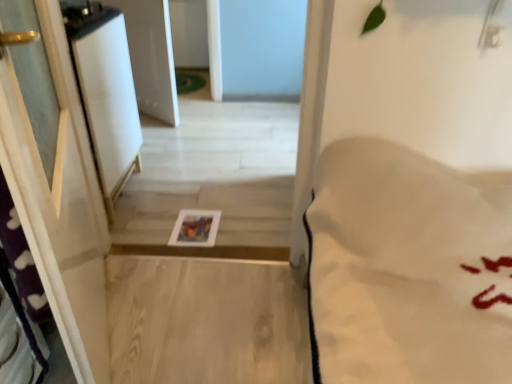
Where is `white soft bedsheet at right`? The image size is (512, 384). white soft bedsheet at right is located at coordinates (408, 268).

What do you see at coordinates (408, 268) in the screenshot? I see `white soft bedsheet at right` at bounding box center [408, 268].

Find the location of a particular element. white glossy screen door at left is located at coordinates (106, 93).

The width and height of the screenshot is (512, 384). Describe the element at coordinates (106, 93) in the screenshot. I see `white glossy screen door at left` at that location.

The image size is (512, 384). Identify the location of white soft bedsheet at right. (408, 268).

Consider the image. Would you say white soft bedsheet at right is to the left or to the right of white glossy screen door at left in the picture?

Clearly, white soft bedsheet at right is on the right of white glossy screen door at left in the image.

Is the depth of white soft bedsheet at right greater than that of white glossy screen door at left?

No, it is in front of white glossy screen door at left.

Is point (410, 271) positioned after point (95, 30)?

No.

From the image's perspective, is white soft bedsheet at right located above or below white glossy screen door at left?

Clearly, from the image's perspective, white soft bedsheet at right is below white glossy screen door at left.

From a real-world perspective, is white soft bedsheet at right positioned over white glossy screen door at left based on gravity?

No, from a real-world perspective, white soft bedsheet at right is not over white glossy screen door at left

Does white soft bedsheet at right have a lesser width compared to white glossy screen door at left?

No, white soft bedsheet at right is not thinner than white glossy screen door at left.

In the scene shown: From their relative heights in the image, would you say white soft bedsheet at right is taller or shorter than white glossy screen door at left?

Clearly, white soft bedsheet at right is taller compared to white glossy screen door at left.

Which of these two, white soft bedsheet at right or white glossy screen door at left, is smaller?

Smaller between the two is white glossy screen door at left.

Is white soft bedsheet at right inside the boundaries of white glossy screen door at left, or outside?

white soft bedsheet at right is spatially situated outside white glossy screen door at left.

Is white soft bedsheet at right far away from white glossy screen door at left?

That's right, there is a large distance between white soft bedsheet at right and white glossy screen door at left.

Is white soft bedsheet at right looking in the opposite direction of white glossy screen door at left?

No, white soft bedsheet at right is not facing away from white glossy screen door at left.

I want to click on sheet lying on the right of white glossy screen door at left, so click(x=408, y=268).

Visually, is white glossy screen door at left positioned to the left or to the right of white soft bedsheet at right?

white glossy screen door at left is positioned on white soft bedsheet at right's left side.

In the image, is white glossy screen door at left positioned in front of or behind white soft bedsheet at right?

Clearly, white glossy screen door at left is behind white soft bedsheet at right.

Which is closer to the camera, (104, 140) or (391, 277)?

The point (391, 277) is closer to the camera.

From the image's perspective, is white glossy screen door at left located above or below white soft bedsheet at right?

Clearly, from the image's perspective, white glossy screen door at left is above white soft bedsheet at right.

From a real-world perspective, who is located lower, white glossy screen door at left or white soft bedsheet at right?

In real-world perspective, white soft bedsheet at right is lower.

Does white glossy screen door at left have a lesser width compared to white soft bedsheet at right?

Correct, the width of white glossy screen door at left is less than that of white soft bedsheet at right.

Considering the sizes of objects white glossy screen door at left and white soft bedsheet at right in the image provided, who is shorter, white glossy screen door at left or white soft bedsheet at right?

Standing shorter between the two is white glossy screen door at left.

Between white glossy screen door at left and white soft bedsheet at right, which one has smaller size?

Smaller between the two is white glossy screen door at left.

Is white glossy screen door at left not inside white soft bedsheet at right?

Indeed, white glossy screen door at left is completely outside white soft bedsheet at right.

Is white glossy screen door at left not close to white soft bedsheet at right?

Yes, white glossy screen door at left and white soft bedsheet at right are located far from each other.

Is white glossy screen door at left facing towards white soft bedsheet at right?

No.

Looking at this image, how many degrees apart are the facing directions of white glossy screen door at left and white soft bedsheet at right?

89.5 degrees.

The image size is (512, 384). I want to click on screen door above the white soft bedsheet at right (from a real-world perspective), so click(106, 93).

Locate an element on the screen. sheet lying in front of the white glossy screen door at left is located at coordinates (408, 268).

Where is `screen door located above the white soft bedsheet at right (from a real-world perspective)`? The image size is (512, 384). screen door located above the white soft bedsheet at right (from a real-world perspective) is located at coordinates (106, 93).